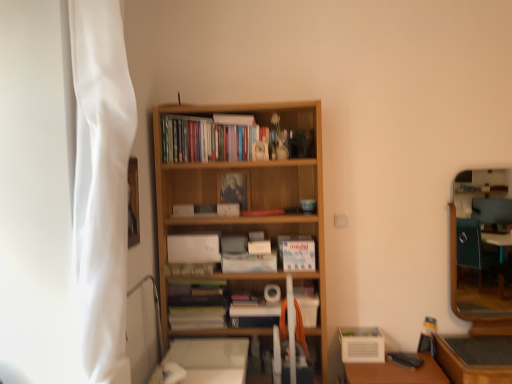
Image resolution: width=512 pixels, height=384 pixels. I want to click on matte wooden frame at center, positioned as the fourth paperback book in bottom-to-top order, so click(x=234, y=189).

Locate an element on the screen. Image resolution: width=512 pixels, height=384 pixels. wooden bookcase at center is located at coordinates tap(248, 201).

What do you see at coordinates (249, 262) in the screenshot?
I see `white matte paperback book at center, placed as the first paperback book when sorted from bottom to top` at bounding box center [249, 262].

Describe the element at coordinates (396, 372) in the screenshot. I see `wooden table at lower right` at that location.

This screenshot has width=512, height=384. I want to click on white matte book at center, the second book viewed from the left, so click(x=296, y=253).

Who is more distant, wooden bookcase at center or wooden table at lower right?

wooden bookcase at center is further from the camera.

Between wooden bookcase at center and wooden table at lower right, which one appears on the left side from the viewer's perspective?

Positioned to the left is wooden bookcase at center.

At what (x,y) coordinates should I click in order to perform the action: click on bookcase above the wooden table at lower right (from a real-world perspective). Please return your answer as a coordinate pair (x, y). This screenshot has width=512, height=384. Looking at the image, I should click on (248, 201).

Based on the photo, which of these two, wooden bookcase at center or wooden table at lower right, is smaller?

wooden table at lower right is smaller.

Is wooden bookshelf at center, which is counted as the 2th book, starting from the right, located outside blue matte paperback book at center, the 3th paperback book positioned from the bottom?

Yes.

You are a GUI agent. You are given a task and a screenshot of the screen. Output one action in this format:
    pyautogui.click(x=<x>, y=<y>)
    Task: Click on the paperback book that is the 3rd object located behind the wooden bookshelf at center, which is counted as the 2th book, starting from the right
    This screenshot has width=512, height=384.
    Given the screenshot: What is the action you would take?
    pyautogui.click(x=206, y=210)

Considering the positions of objects wooden bookshelf at center, which ranks as the 2th book in bottom-to-top order, and blue matte paperback book at center, which is the second paperback book from top to bottom, in the image provided, who is more to the right, wooden bookshelf at center, which ranks as the 2th book in bottom-to-top order, or blue matte paperback book at center, which is the second paperback book from top to bottom,?

wooden bookshelf at center, which ranks as the 2th book in bottom-to-top order.

Is wooden bookshelf at center, which is counted as the 2th book, starting from the right, next to blue matte paperback book at center, the 3th paperback book positioned from the bottom, and touching it?

No, wooden bookshelf at center, which is counted as the 2th book, starting from the right, is not making contact with blue matte paperback book at center, the 3th paperback book positioned from the bottom.

Is wooden framed mirror at right facing towards wooden bookcase at center?

No, wooden framed mirror at right is not facing towards wooden bookcase at center.

Can you confirm if wooden framed mirror at right is positioned to the right of wooden bookcase at center?

Yes, wooden framed mirror at right is to the right of wooden bookcase at center.

What's the angular difference between wooden framed mirror at right and wooden bookcase at center's facing directions?

wooden framed mirror at right and wooden bookcase at center are facing 0.18 degrees away from each other.

Is wooden framed mirror at right shorter than wooden bookcase at center?

Yes.

Is white fabric curtain at left at the back of matte wooden frame at center, positioned as the fourth paperback book in bottom-to-top order?

matte wooden frame at center, positioned as the fourth paperback book in bottom-to-top order, is not turned away from white fabric curtain at left.

Is point (240, 180) more distant than point (105, 359)?

Yes, it is.

Does matte wooden frame at center, positioned as the fourth paperback book in bottom-to-top order, appear on the left side of white fabric curtain at left?

No.

From the image's perspective, is white matte book at center, the second book viewed from the left, positioned above or below white fabric curtain at left?

Based on their image positions, white matte book at center, the second book viewed from the left, is located beneath white fabric curtain at left.

Which is closer, [307,268] or [125,360]?

Point [307,268] is farther from the camera than point [125,360].

In terms of height, does white matte book at center, acting as the second book starting from the top, look taller or shorter compared to white fabric curtain at left?

In the image, white matte book at center, acting as the second book starting from the top, appears to be shorter than white fabric curtain at left.

Which is more to the left, white matte book at center, the 1th book when ordered from bottom to top, or white fabric curtain at left?

Positioned to the left is white fabric curtain at left.

Is white matte book at center, the 1th book when ordered from right to left, not close to blue matte paperback book at center, the 3th paperback book positioned from the bottom?

They are positioned close to each other.

Considering the positions of objects white matte book at center, the second book viewed from the left, and blue matte paperback book at center, which is the second paperback book from top to bottom, in the image provided, who is more to the right, white matte book at center, the second book viewed from the left, or blue matte paperback book at center, which is the second paperback book from top to bottom,?

white matte book at center, the second book viewed from the left.

Can we say white matte book at center, the 1th book when ordered from bottom to top, lies outside blue matte paperback book at center, the 3th paperback book positioned from the bottom?

Indeed, white matte book at center, the 1th book when ordered from bottom to top, is completely outside blue matte paperback book at center, the 3th paperback book positioned from the bottom.

Is white matte paperback book at center, placed as the first paperback book when sorted from bottom to top, positioned before wooden table at lower right?

No, it is not.

From a real-world perspective, is white matte paperback book at center, placed as the first paperback book when sorted from bottom to top, above or below wooden table at lower right?

From a real-world perspective, white matte paperback book at center, placed as the first paperback book when sorted from bottom to top, is physically above wooden table at lower right.

Is white matte paperback book at center, placed as the first paperback book when sorted from bottom to top, bigger or smaller than wooden table at lower right?

In the image, white matte paperback book at center, placed as the first paperback book when sorted from bottom to top, appears to be smaller than wooden table at lower right.

Which is in front, point (260, 266) or point (355, 374)?

The point (355, 374) is more forward.

Identify the location of bookcase above the wooden table at lower right (from the image's perspective). (248, 201).

The image size is (512, 384). In order to click on the 2nd book in front of the blue matte paperback book at center, the 3th paperback book positioned from the bottom in this screenshot , I will do `click(231, 139)`.

In the scene shown: When comparing their distances from wooden framed mirror at right, does white fabric curtain at left or white matte paperback book at center, the 3th paperback book viewed from the top, seem further?

white fabric curtain at left is further to wooden framed mirror at right.

When comparing their distances from white matte paperback book at center, placed as the first paperback book when sorted from bottom to top, does white fabric curtain at left or blue matte paperback book at center, the 3th paperback book positioned from the bottom, seem closer?

The object closer to white matte paperback book at center, placed as the first paperback book when sorted from bottom to top, is blue matte paperback book at center, the 3th paperback book positioned from the bottom.

Based on their spatial positions, is white fabric curtain at left or wooden framed mirror at right closer to blue matte paperback book at center, the 3th paperback book positioned from the bottom?

white fabric curtain at left is positioned closer to the anchor blue matte paperback book at center, the 3th paperback book positioned from the bottom.

Which object lies nearer to the anchor point wooden bookcase at center, wooden framed mirror at right or blue matte paperback book at center, which is the second paperback book from top to bottom?

blue matte paperback book at center, which is the second paperback book from top to bottom, is closer to wooden bookcase at center.

Based on their spatial positions, is wooden bookshelf at center, which is counted as the 2th book, starting from the right, or blue matte paperback book at center, which is the second paperback book from top to bottom, closer to wooden table at lower right?

Based on the image, blue matte paperback book at center, which is the second paperback book from top to bottom, appears to be nearer to wooden table at lower right.

Based on their spatial positions, is white matte paperback book at center, placed as the first paperback book when sorted from bottom to top, or white matte book at center, acting as the second book starting from the top, closer to wooden bookshelf at center, which is the 1th book from left to right?

white matte book at center, acting as the second book starting from the top, is positioned closer to the anchor wooden bookshelf at center, which is the 1th book from left to right.

Consider the image. Looking at the image, which one is located closer to wooden bookcase at center, matte wooden frame at center, the first paperback book positioned from the top, or white matte paperback book at center, placed as the first paperback book when sorted from bottom to top?

The object closer to wooden bookcase at center is matte wooden frame at center, the first paperback book positioned from the top.

Which object lies further to the anchor point blue matte paperback book at center, which is the second paperback book from top to bottom, white matte paperback book at center, the 4th paperback book viewed from the top, or wooden framed mirror at right?

Among the two, wooden framed mirror at right is located further to blue matte paperback book at center, which is the second paperback book from top to bottom.

This screenshot has height=384, width=512. Identify the location of book between matte wooden frame at center, positioned as the fourth paperback book in bottom-to-top order, and wooden framed mirror at right. (296, 253).

Image resolution: width=512 pixels, height=384 pixels. What are the coordinates of `bookcase positioned between white fabric curtain at left and blue matte paperback book at center, the 3th paperback book positioned from the bottom, from near to far` in the screenshot? It's located at (248, 201).

Locate an element on the screen. The width and height of the screenshot is (512, 384). book between white matte paperback book at center, the 4th paperback book viewed from the top, and wooden table at lower right from left to right is located at coordinates (296, 253).

Where is `paperback book between wooden bookshelf at center, which ranks as the 2th book in bottom-to-top order, and blue matte paperback book at center, the 3th paperback book positioned from the bottom, from top to bottom`? This screenshot has height=384, width=512. paperback book between wooden bookshelf at center, which ranks as the 2th book in bottom-to-top order, and blue matte paperback book at center, the 3th paperback book positioned from the bottom, from top to bottom is located at coordinates (234, 189).